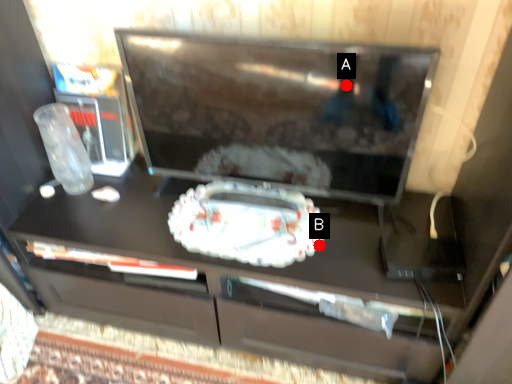
Question: Two points are circled on the image, labeled by A and B beside each circle. Which of the following is the farthest from the observer?

Choices:
 (A) A is further
 (B) B is further

Answer: (B)